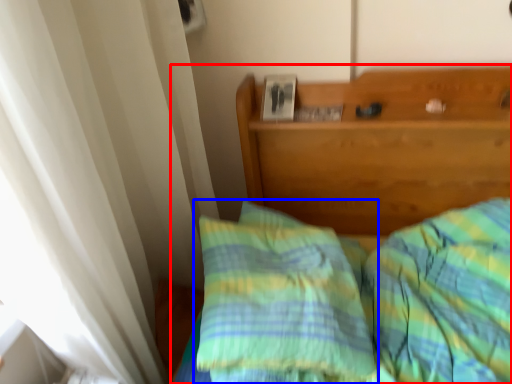
Question: Which object appears farthest to the camera in this image, bed (highlighted by a red box) or pillow (highlighted by a blue box)?

Choices:
 (A) bed
 (B) pillow

Answer: (B)